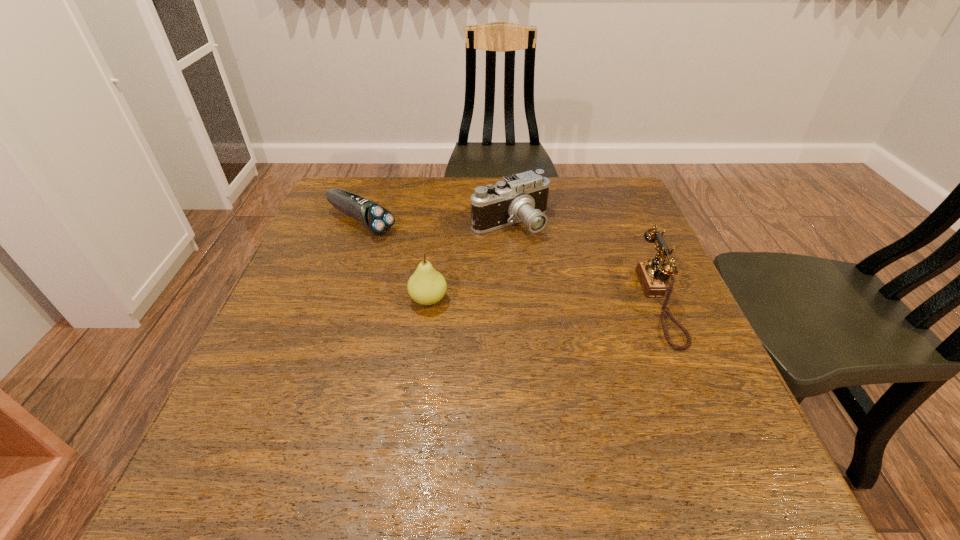
Where is `vacant spot on the desktop that is between the third object from right to left and the rightmost object and is positioned on the head of the leftmost object`? Image resolution: width=960 pixels, height=540 pixels. vacant spot on the desktop that is between the third object from right to left and the rightmost object and is positioned on the head of the leftmost object is located at coordinates (510, 301).

Identify the location of free spot on the desktop that is between the third object from right to left and the rightmost object and is positioned at the lens of the third object from left to right. (564, 301).